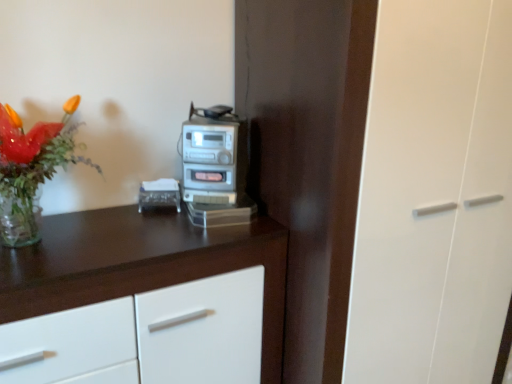
Find the location of a particular element. vacant area that lies to the right of translucent glass vase at upper left is located at coordinates (137, 242).